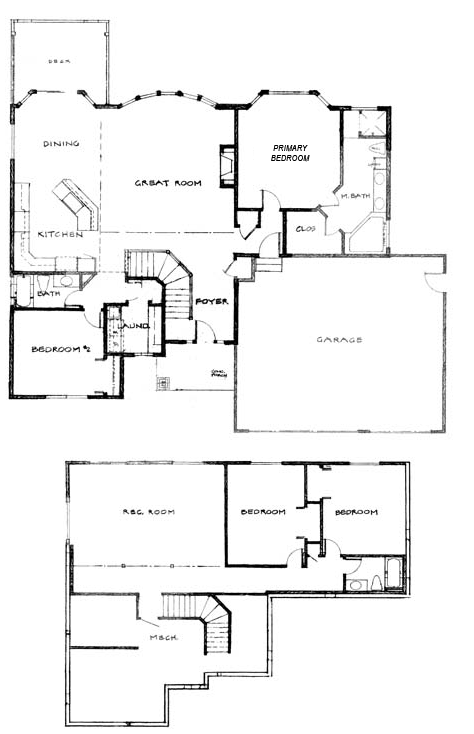
I want to click on kitchen, so click(59, 225).